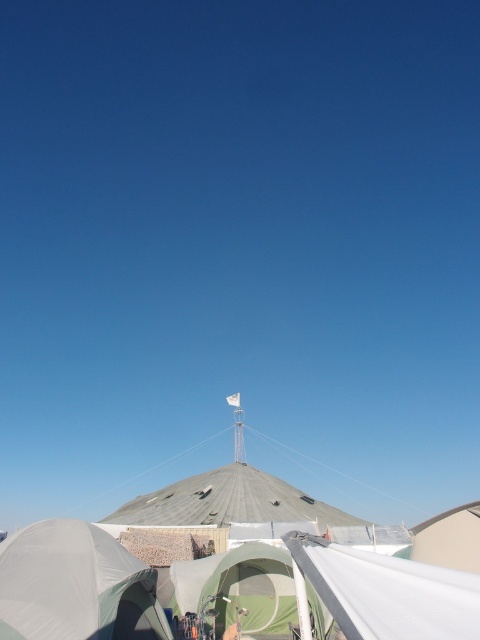
You are setting up a camping site and need to place a new tent. You have two options in the scene, the white matte canopy at lower right and the green fabric tent at center. Which one is a better choice if you want a larger shelter for more people?

The green fabric tent at center is larger than the white matte canopy at lower right, so it is a better choice for a larger shelter for more people.

You are setting up a picnic area and want to place a picnic basket between the white fabric tent at center and the flagpole on its peak. How far apart are these two objects?

The white fabric tent at center and the flagpole on its peak are 8.24 feet apart.

You are standing at the entrance of the large conical tent and want to place a decoration exactly at the center of the white fabric tent at center. According to the coordinates provided, is the point where you should place the decoration located to the left or right of the flagpole on the tent peak?

The white fabric tent at center is located at point (222, 570). Since the flagpole is on the tent peak at the top center, the decoration point is to the right of the flagpole.